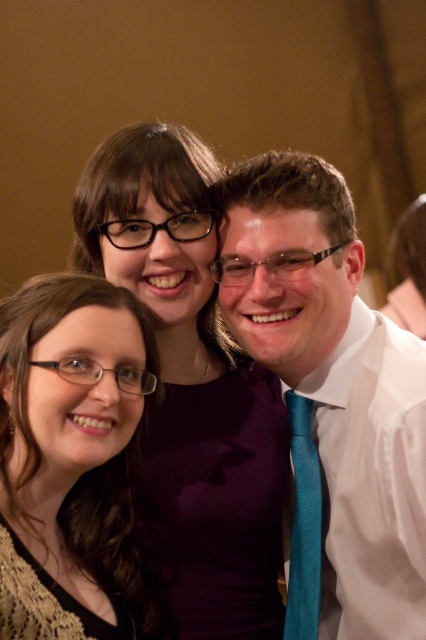
You are a photographer setting up for a group photo. You need to ensure that the white glossy shirt at center and the purple fabric dress at center are both visible in the frame. Given their sizes, which one might require more space horizontally to avoid being cropped?

The purple fabric dress at center requires more horizontal space because it is wider than the white glossy shirt at center.

You are a photographer adjusting the lighting for a portrait. You notice a point at coordinates (190, 388) in the image. Based on the scene description, what object is this point located on?

The point at coordinates (190, 388) is located on the purple fabric dress at center.